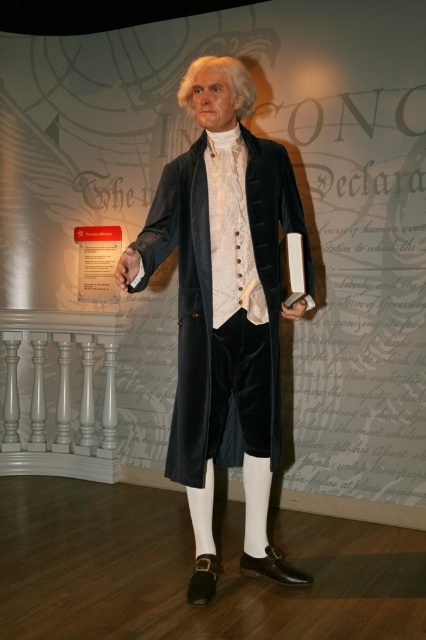
Question: Which object is farther from the camera taking this photo?

Choices:
 (A) white/smooth wig at upper center
 (B) velvet black coat at center
 (C) white matte hand at center
 (D) white matte paper at center

Answer: (D)

Question: Does velvet black coat at center appear on the left side of white matte hand at center?

Choices:
 (A) no
 (B) yes

Answer: (A)

Question: Which of the following is the farthest from the observer?

Choices:
 (A) (173, 474)
 (B) (137, 268)

Answer: (A)

Question: Is white/smooth wig at upper center to the right of white matte hand at center from the viewer's perspective?

Choices:
 (A) no
 (B) yes

Answer: (B)

Question: Does velvet black coat at center come behind white matte paper at center?

Choices:
 (A) no
 (B) yes

Answer: (A)

Question: Among these objects, which one is nearest to the camera?

Choices:
 (A) white matte hand at center
 (B) white matte paper at center
 (C) white/smooth wig at upper center
 (D) velvet black coat at center

Answer: (A)